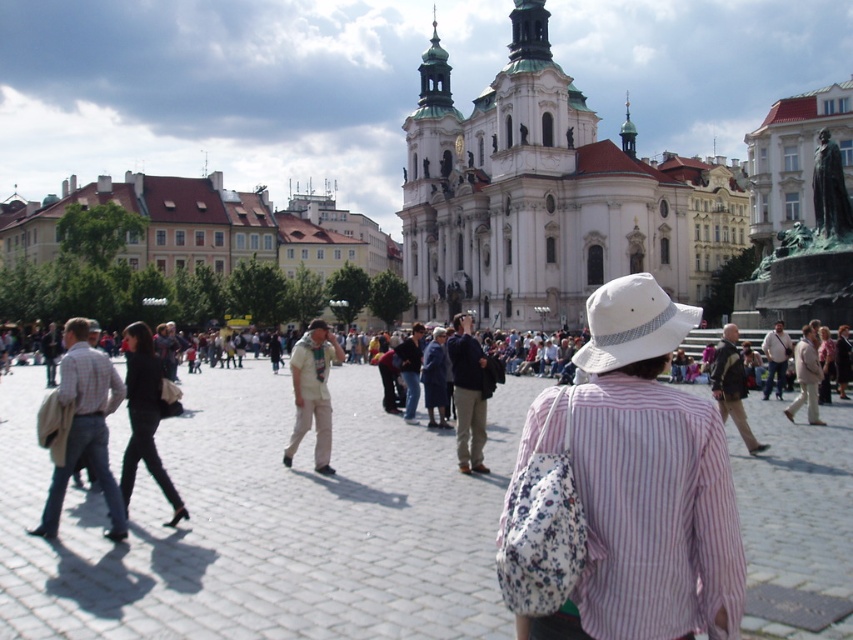
You are standing in the European town square and want to take a photo of the church. There is a specific point at coordinates point (410, 237) that you need to ensure is in the frame. Given that your camera has a maximum focus range of 450 feet, will you be able to capture this point clearly?

The distance of point (410, 237) from the camera is 469.17 feet, which exceeds the camera maximum focus range of 450 feet. Therefore, you will not be able to capture this point clearly.

You are standing in the European town square and want to take a photo of the white marble church at center without the white cotton hat at center blocking the view. Is the hat currently in front of the church from your perspective?

The white marble church at center is above the white cotton hat at center, so the hat is below the church in your view. Therefore, the hat is not blocking the church from your perspective.

You are standing in the town square and want to find the white marble church at center. According to the map, it should be at point (547,196). Can you tell me where exactly the white marble church at center is located in the square?

The white marble church at center is located at point (547,196), which means it is positioned approximately 30.8 percent from the left edge and 64.2 percent from the top edge of the square.